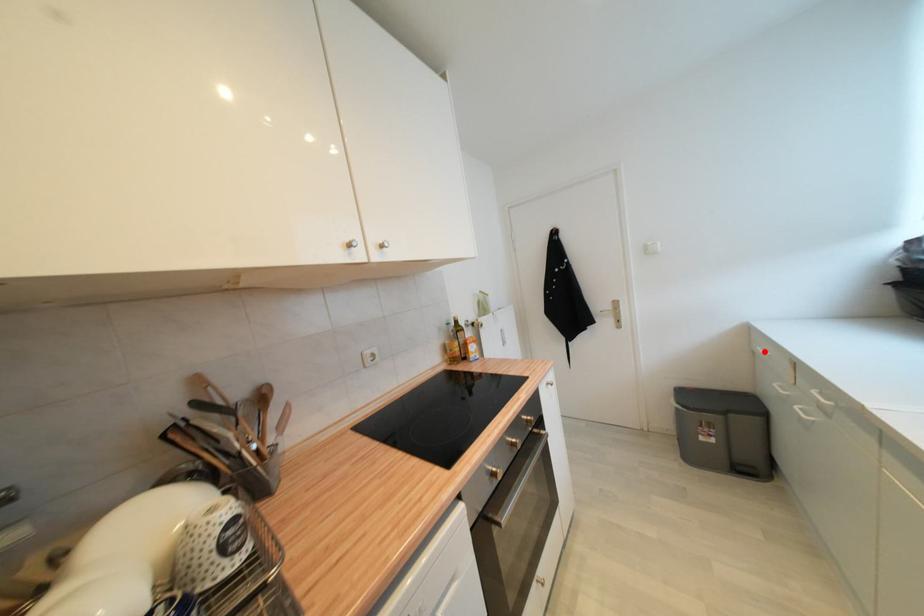
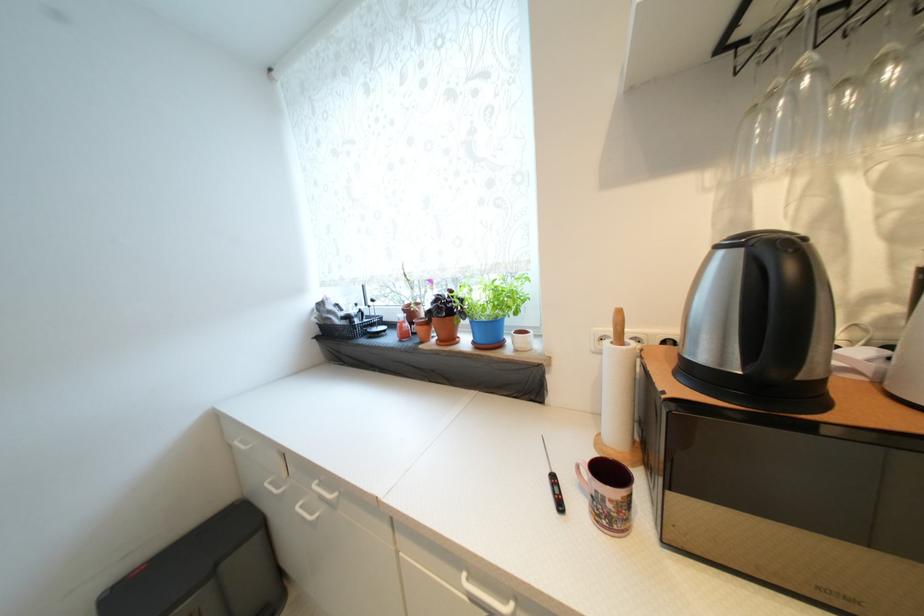
In the second image, find the point that corresponds to the highlighted location in the first image.

(242, 445)